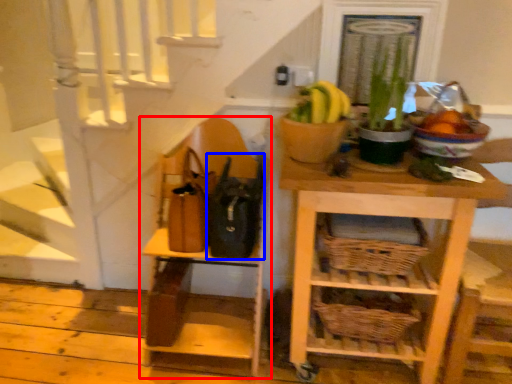
Question: Which of the following is the closest to the observer, shelf (highlighted by a red box) or bag (highlighted by a blue box)?

Choices:
 (A) shelf
 (B) bag

Answer: (A)